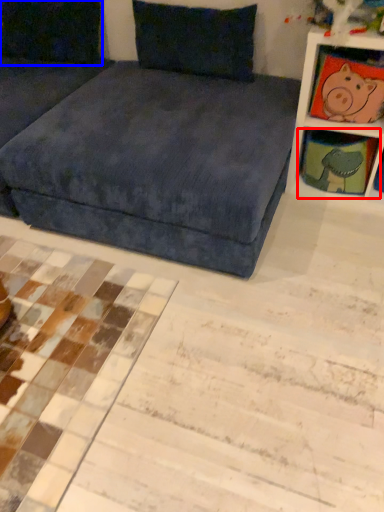
Question: Among these objects, which one is farthest to the camera, shelf (highlighted by a red box) or pillow (highlighted by a blue box)?

Choices:
 (A) shelf
 (B) pillow

Answer: (B)